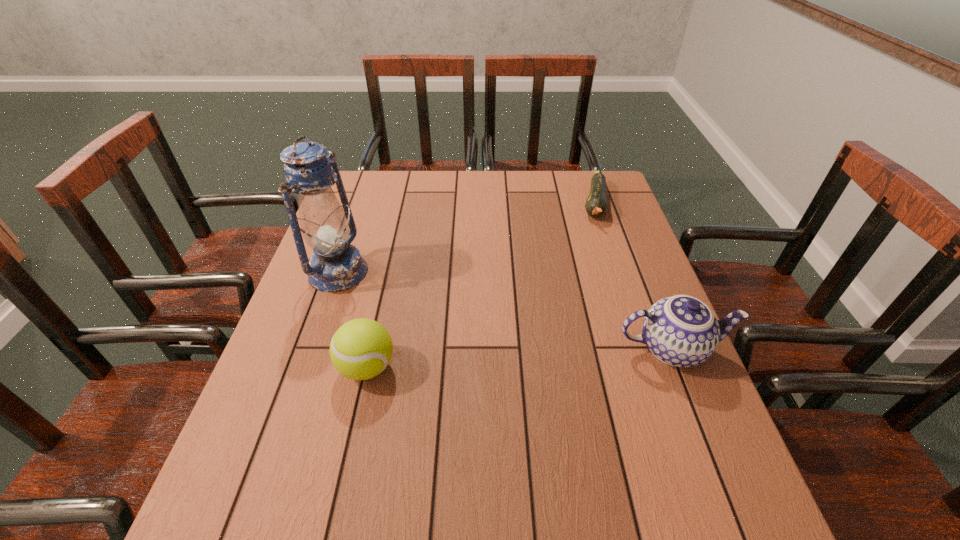
The width and height of the screenshot is (960, 540). Find the location of `free space at the near edge of the desktop`. free space at the near edge of the desktop is located at coordinates (435, 471).

Identify the location of free location at the left edge of the desktop. The width and height of the screenshot is (960, 540). (301, 307).

The height and width of the screenshot is (540, 960). Identify the location of blank area at the right edge. (637, 268).

This screenshot has width=960, height=540. In the image, there is a desktop. In order to click on blank space at the far right corner in this screenshot , I will do `click(611, 183)`.

Where is `free space between the second tallest object and the farthest object`? Image resolution: width=960 pixels, height=540 pixels. free space between the second tallest object and the farthest object is located at coordinates (634, 276).

At what (x,y) coordinates should I click in order to perform the action: click on empty location between the second shortest object and the farthest object. Please return your answer as a coordinate pair (x, y). Image resolution: width=960 pixels, height=540 pixels. Looking at the image, I should click on (481, 286).

Find the location of `blank region between the second farthest object and the third tallest object`. blank region between the second farthest object and the third tallest object is located at coordinates (352, 320).

Locate an element on the screen. vacant area between the tallest object and the tennis ball is located at coordinates (352, 320).

This screenshot has height=540, width=960. I want to click on free space between the tennis ball and the chinaware, so click(x=519, y=358).

You are a GUI agent. You are given a task and a screenshot of the screen. Output one action in this format:
    pyautogui.click(x=<x>, y=<y>)
    Task: Click on the vacant space that's between the second tallest object and the tennis ball
    This screenshot has width=960, height=540.
    Given the screenshot: What is the action you would take?
    pyautogui.click(x=519, y=358)